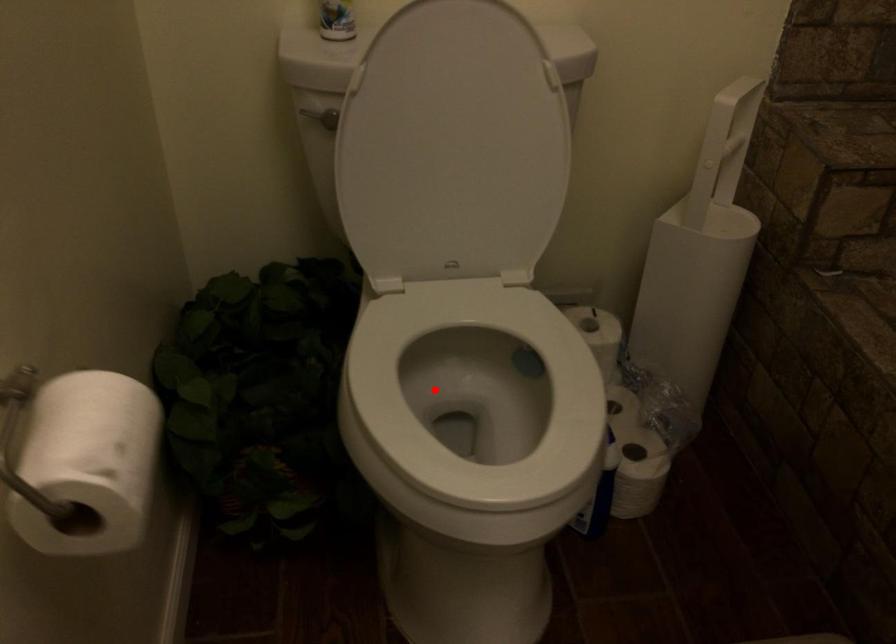
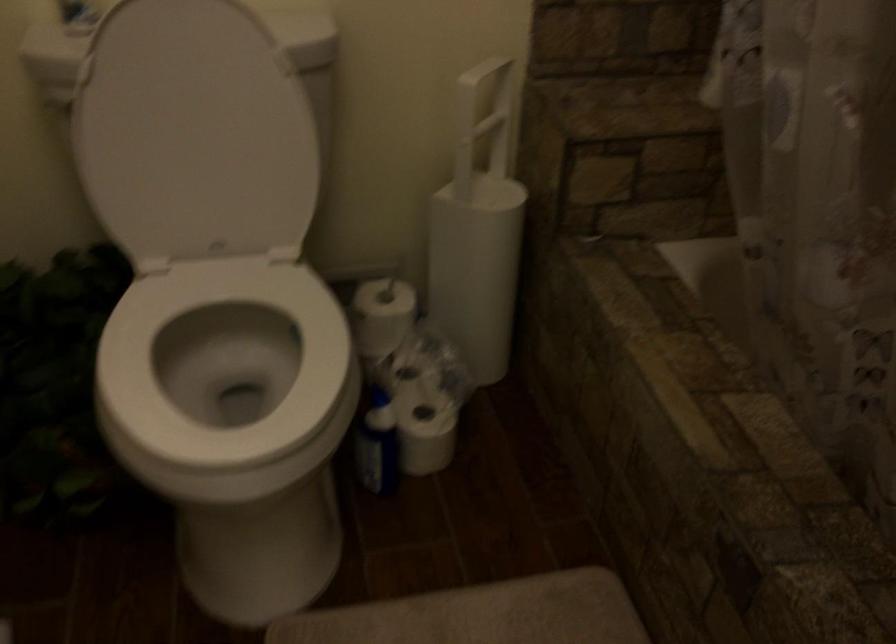
In the second image, find the point that corresponds to the highlighted location in the first image.

(224, 365)